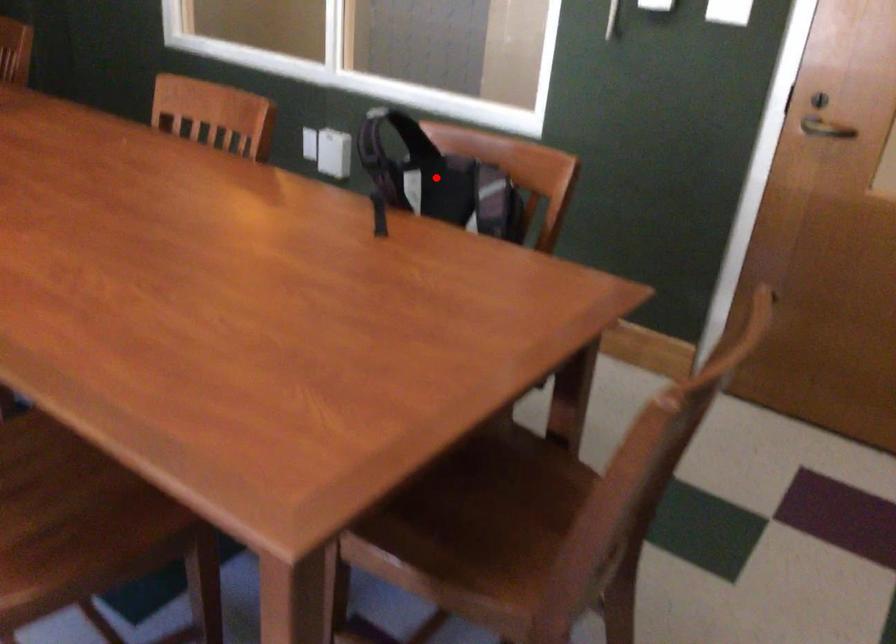
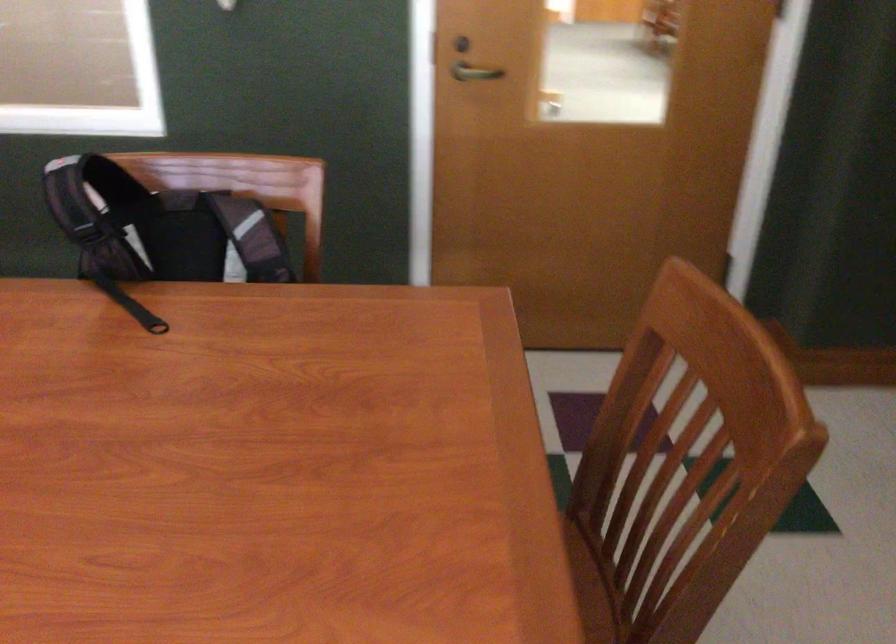
Question: I am providing you with two images of the same scene from different viewpoints. In image1, a red point is highlighted. Considering the same 3D point in image2, which of the following is correct?

Choices:
 (A) It is closer
 (B) It is farther

Answer: (A)